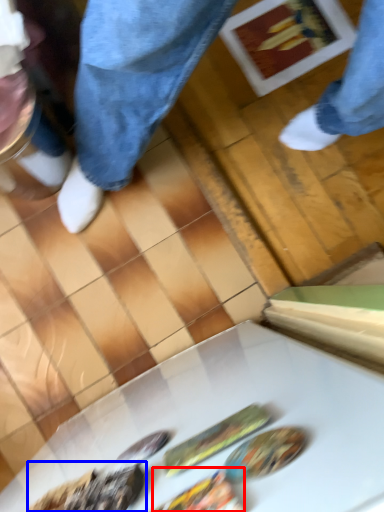
Question: Which object appears closest to the camera in this image, food (highlighted by a red box) or food (highlighted by a blue box)?

Choices:
 (A) food
 (B) food

Answer: (A)